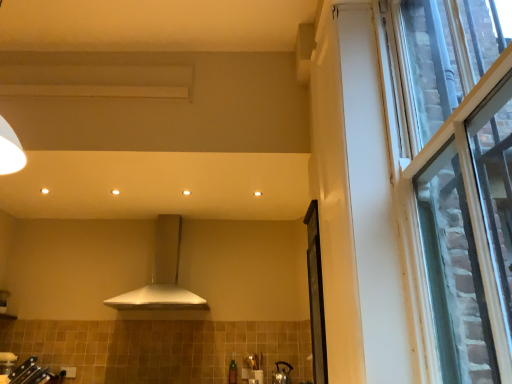
Question: Should I look upward or downward to see matte silver kettle at lower center?

Choices:
 (A) down
 (B) up

Answer: (A)

Question: From a real-world perspective, is transparent glass screen door at right physically above white matte range hood at center?

Choices:
 (A) no
 (B) yes

Answer: (A)

Question: Considering the relative sizes of transparent glass screen door at right and white matte range hood at center in the image provided, is transparent glass screen door at right thinner than white matte range hood at center?

Choices:
 (A) no
 (B) yes

Answer: (B)

Question: Is white matte range hood at center located within transparent glass screen door at right?

Choices:
 (A) yes
 (B) no

Answer: (B)

Question: From a real-world perspective, is transparent glass screen door at right located beneath white matte range hood at center?

Choices:
 (A) yes
 (B) no

Answer: (A)

Question: Is transparent glass screen door at right far from white matte range hood at center?

Choices:
 (A) yes
 (B) no

Answer: (A)

Question: Considering the relative sizes of transparent glass screen door at right and white matte range hood at center in the image provided, is transparent glass screen door at right bigger than white matte range hood at center?

Choices:
 (A) yes
 (B) no

Answer: (B)

Question: Considering the relative sizes of clear glass window at right and transparent glass screen door at right in the image provided, is clear glass window at right bigger than transparent glass screen door at right?

Choices:
 (A) yes
 (B) no

Answer: (A)

Question: Is clear glass window at right in front of transparent glass screen door at right?

Choices:
 (A) no
 (B) yes

Answer: (B)

Question: From a real-world perspective, is clear glass window at right positioned over transparent glass screen door at right based on gravity?

Choices:
 (A) yes
 (B) no

Answer: (A)

Question: Are clear glass window at right and transparent glass screen door at right far apart?

Choices:
 (A) yes
 (B) no

Answer: (A)

Question: Does clear glass window at right have a lesser height compared to transparent glass screen door at right?

Choices:
 (A) no
 (B) yes

Answer: (A)

Question: Is clear glass window at right outside of transparent glass screen door at right?

Choices:
 (A) yes
 (B) no

Answer: (A)

Question: From a real-world perspective, is transparent glass screen door at right under clear glass window at right?

Choices:
 (A) yes
 (B) no

Answer: (A)